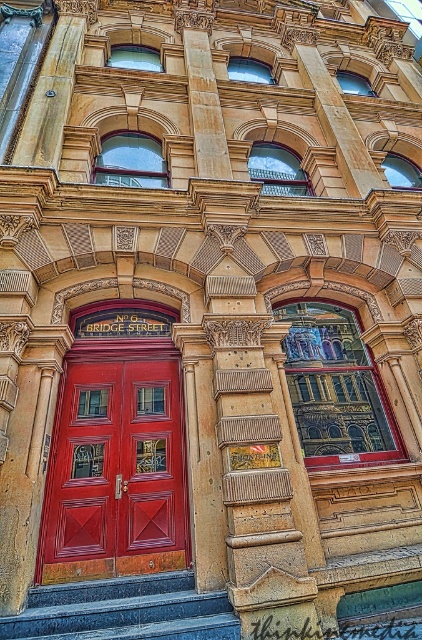
Identify the location of matte wood door at center. The width and height of the screenshot is (422, 640). (115, 467).

Is point (84, 385) positioned after point (151, 579)?

Yes, point (84, 385) is farther from viewer.

Who is more forward, (141,371) or (13,618)?

Point (13,618)

This screenshot has height=640, width=422. Identify the location of matte wood door at center. (115, 467).